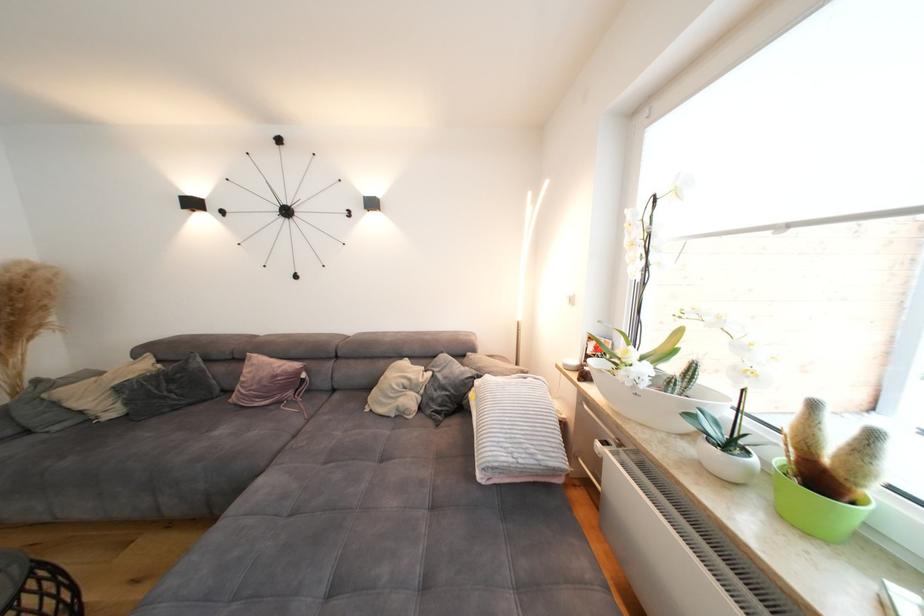
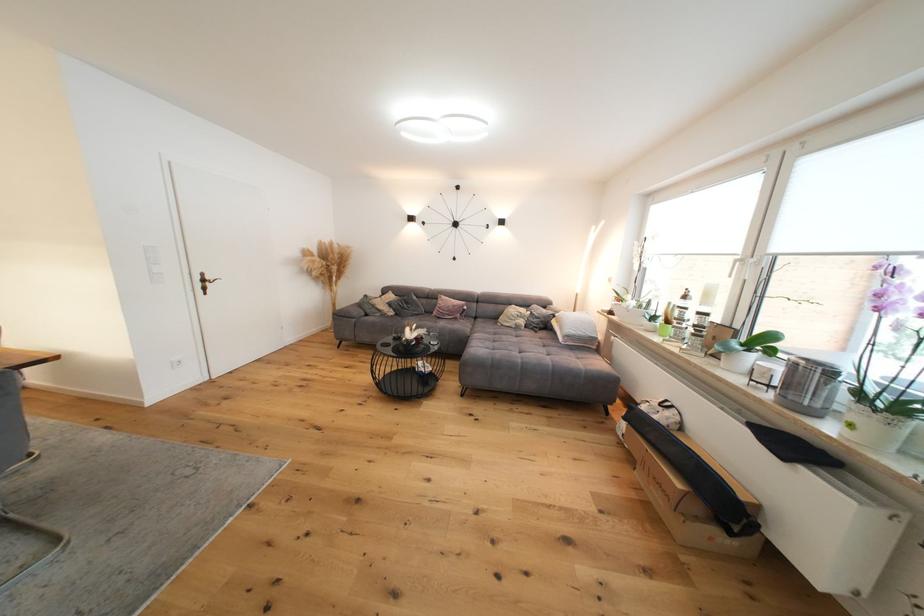
Question: Which direction would the cameraman need to move to produce the second image? Reply with the corresponding letter.

Choices:
 (A) Left
 (B) Right
 (C) Forward
 (D) Backward

Answer: (D)